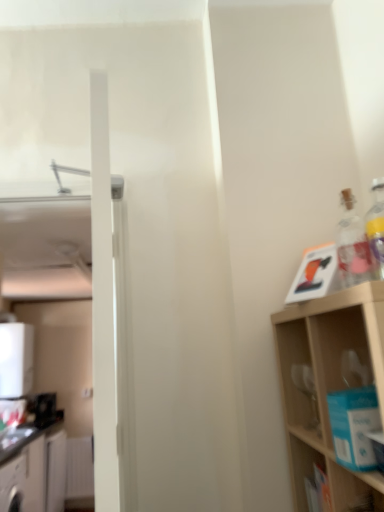
The image size is (384, 512). What do you see at coordinates (352, 244) in the screenshot? I see `transparent glass bottle at upper right` at bounding box center [352, 244].

I want to click on white glossy cabinet at lower left, which is counted as the second cabinetry, starting from the back, so click(13, 485).

Find the location of a particular element. transparent glass bottle at upper right is located at coordinates (352, 244).

Is white glossy cabinet at lower left, the second cabinetry when ordered from front to back, in contact with black plastic toaster at left, arranged as the first appliance when ordered from the bottom?

white glossy cabinet at lower left, the second cabinetry when ordered from front to back, and black plastic toaster at left, arranged as the first appliance when ordered from the bottom, are not in contact.

From the picture: In the image, is white glossy cabinet at lower left, the 1th cabinetry viewed from the back, positioned in front of or behind black plastic toaster at left, the second appliance when ordered from top to bottom?

white glossy cabinet at lower left, the 1th cabinetry viewed from the back, is positioned closer to the viewer than black plastic toaster at left, the second appliance when ordered from top to bottom.

In the scene shown: From the image's perspective, is white glossy cabinet at lower left, the 1th cabinetry viewed from the back, beneath black plastic toaster at left, the second appliance when ordered from top to bottom?

Yes, from the image's perspective, white glossy cabinet at lower left, the 1th cabinetry viewed from the back, is below black plastic toaster at left, the second appliance when ordered from top to bottom.

From a real-world perspective, is white glossy cabinet at lower left, the 1th cabinetry viewed from the back, positioned above or below black plastic toaster at left, the second appliance when ordered from top to bottom?

white glossy cabinet at lower left, the 1th cabinetry viewed from the back, is below black plastic toaster at left, the second appliance when ordered from top to bottom.

Does black plastic toaster at left, the second appliance when ordered from top to bottom, have a lesser height compared to wooden shelf at right?

Yes.

How many degrees apart are the facing directions of black plastic toaster at left, arranged as the first appliance when ordered from the bottom, and wooden shelf at right?

They differ by 90.1 degrees in their facing directions.

Image resolution: width=384 pixels, height=512 pixels. What are the coordinates of `the 1st appliance to the left when counting from the wooden shelf at right` in the screenshot? It's located at (44, 409).

Does black plastic toaster at left, arranged as the first appliance when ordered from the bottom, have a greater width compared to wooden shelf at right?

In fact, black plastic toaster at left, arranged as the first appliance when ordered from the bottom, might be narrower than wooden shelf at right.

Is white glossy cabinet at lower left, the second cabinetry when ordered from front to back, positioned in front of transparent glass bottle at upper right?

No, it is not.

From the picture: From the image's perspective, between white glossy cabinet at lower left, the 1th cabinetry viewed from the back, and transparent glass bottle at upper right, which one is located above?

transparent glass bottle at upper right.

Is white glossy cabinet at lower left, the second cabinetry when ordered from front to back, facing away from transparent glass bottle at upper right?

white glossy cabinet at lower left, the second cabinetry when ordered from front to back, does not have its back to transparent glass bottle at upper right.

Is there a large distance between white glossy cabinet at lower left, the second cabinetry when ordered from front to back, and transparent glass bottle at upper right?

white glossy cabinet at lower left, the second cabinetry when ordered from front to back, is positioned a significant distance from transparent glass bottle at upper right.

Which is correct: white glossy water heater at left, the second appliance when ordered from bottom to top, is inside transparent glass bottle at upper right, or outside of it?

white glossy water heater at left, the second appliance when ordered from bottom to top, is spatially situated outside transparent glass bottle at upper right.

Considering the positions of points (9, 336) and (362, 233), is point (9, 336) farther from camera compared to point (362, 233)?

That is True.

Considering the positions of objects white glossy water heater at left, the second appliance when ordered from bottom to top, and transparent glass bottle at upper right in the image provided, who is more to the right, white glossy water heater at left, the second appliance when ordered from bottom to top, or transparent glass bottle at upper right?

From the viewer's perspective, transparent glass bottle at upper right appears more on the right side.

From the image's perspective, which object appears higher, white glossy water heater at left, the second appliance when ordered from bottom to top, or transparent glass bottle at upper right?

transparent glass bottle at upper right, from the image's perspective.

Which of these two, wooden shelf at right or white glossy cabinet at lower left, the 1th cabinetry viewed from the back, is bigger?

With larger size is white glossy cabinet at lower left, the 1th cabinetry viewed from the back.

Is point (355, 484) less distant than point (47, 500)?

Yes, point (355, 484) is in front of point (47, 500).

Which cabinetry is the 2nd one when counting from the left side of the wooden shelf at right? Please provide its 2D coordinates.

[(33, 469)]

From the image's perspective, is white glossy water heater at left, positioned as the first appliance in top-to-bottom order, on top of black plastic toaster at left, the second appliance when ordered from top to bottom?

Correct, white glossy water heater at left, positioned as the first appliance in top-to-bottom order, appears higher than black plastic toaster at left, the second appliance when ordered from top to bottom, in the image.

Considering the sizes of objects white glossy water heater at left, the second appliance when ordered from bottom to top, and black plastic toaster at left, the second appliance when ordered from top to bottom, in the image provided, who is taller, white glossy water heater at left, the second appliance when ordered from bottom to top, or black plastic toaster at left, the second appliance when ordered from top to bottom,?

white glossy water heater at left, the second appliance when ordered from bottom to top.

In the scene shown: Does white glossy water heater at left, the second appliance when ordered from bottom to top, appear on the left side of black plastic toaster at left, the second appliance when ordered from top to bottom?

Correct, you'll find white glossy water heater at left, the second appliance when ordered from bottom to top, to the left of black plastic toaster at left, the second appliance when ordered from top to bottom.

Is point (17, 466) less distant than point (38, 394)?

Yes, point (17, 466) is closer to viewer.

Is white glossy cabinet at lower left, which is counted as the second cabinetry, starting from the back, positioned far away from black plastic toaster at left, the second appliance when ordered from top to bottom?

Actually, white glossy cabinet at lower left, which is counted as the second cabinetry, starting from the back, and black plastic toaster at left, the second appliance when ordered from top to bottom, are a little close together.

Looking at their sizes, would you say white glossy cabinet at lower left, the first cabinetry viewed from the front, is wider or thinner than black plastic toaster at left, arranged as the first appliance when ordered from the bottom?

In the image, white glossy cabinet at lower left, the first cabinetry viewed from the front, appears to be more narrow than black plastic toaster at left, arranged as the first appliance when ordered from the bottom.

Could you measure the distance between white glossy cabinet at lower left, the first cabinetry viewed from the front, and black plastic toaster at left, the second appliance when ordered from top to bottom?

A distance of 33.13 inches exists between white glossy cabinet at lower left, the first cabinetry viewed from the front, and black plastic toaster at left, the second appliance when ordered from top to bottom.

From the image's perspective, count 1st appliances upward from the white glossy cabinet at lower left, the 1th cabinetry viewed from the back, and point to it. Please provide its 2D coordinates.

[(44, 409)]

This screenshot has height=512, width=384. I want to click on appliance that is the 2nd object located behind the wooden shelf at right, so click(44, 409).

Which object lies further to the anchor point black plastic toaster at left, arranged as the first appliance when ordered from the bottom, white glossy cabinet at lower left, the second cabinetry when ordered from front to back, or white glossy cabinet at lower left, which is counted as the second cabinetry, starting from the back?

Based on the image, white glossy cabinet at lower left, which is counted as the second cabinetry, starting from the back, appears to be further to black plastic toaster at left, arranged as the first appliance when ordered from the bottom.

Considering their positions, is wooden shelf at right positioned further to white glossy cabinet at lower left, the 1th cabinetry viewed from the back, than black plastic toaster at left, the second appliance when ordered from top to bottom?

Based on the image, wooden shelf at right appears to be further to white glossy cabinet at lower left, the 1th cabinetry viewed from the back.

Looking at the image, which one is located closer to white glossy cabinet at lower left, which is counted as the second cabinetry, starting from the back, white glossy cabinet at lower left, the 1th cabinetry viewed from the back, or black plastic toaster at left, the second appliance when ordered from top to bottom?

The object closer to white glossy cabinet at lower left, which is counted as the second cabinetry, starting from the back, is white glossy cabinet at lower left, the 1th cabinetry viewed from the back.

From the image, which object appears to be nearer to white glossy water heater at left, the second appliance when ordered from bottom to top, wooden shelf at right or white glossy cabinet at lower left, the 1th cabinetry viewed from the back?

Among the two, white glossy cabinet at lower left, the 1th cabinetry viewed from the back, is located nearer to white glossy water heater at left, the second appliance when ordered from bottom to top.

Looking at the image, which one is located further to white glossy cabinet at lower left, the first cabinetry viewed from the front, black plastic toaster at left, arranged as the first appliance when ordered from the bottom, or white glossy water heater at left, positioned as the first appliance in top-to-bottom order?

Based on the image, white glossy water heater at left, positioned as the first appliance in top-to-bottom order, appears to be further to white glossy cabinet at lower left, the first cabinetry viewed from the front.

Based on their spatial positions, is black plastic toaster at left, the second appliance when ordered from top to bottom, or wooden shelf at right further from transparent glass bottle at upper right?

black plastic toaster at left, the second appliance when ordered from top to bottom.

When comparing their distances from white glossy water heater at left, the second appliance when ordered from bottom to top, does white glossy cabinet at lower left, the first cabinetry viewed from the front, or wooden shelf at right seem closer?

white glossy cabinet at lower left, the first cabinetry viewed from the front, is positioned closer to the anchor white glossy water heater at left, the second appliance when ordered from bottom to top.

From the image, which object appears to be nearer to white glossy cabinet at lower left, the first cabinetry viewed from the front, white glossy cabinet at lower left, the 1th cabinetry viewed from the back, or white glossy water heater at left, the second appliance when ordered from bottom to top?

The object closer to white glossy cabinet at lower left, the first cabinetry viewed from the front, is white glossy cabinet at lower left, the 1th cabinetry viewed from the back.

Where is `appliance located between white glossy cabinet at lower left, the first cabinetry viewed from the front, and black plastic toaster at left, arranged as the first appliance when ordered from the bottom, in the depth direction`? Image resolution: width=384 pixels, height=512 pixels. appliance located between white glossy cabinet at lower left, the first cabinetry viewed from the front, and black plastic toaster at left, arranged as the first appliance when ordered from the bottom, in the depth direction is located at coordinates (16, 359).

The image size is (384, 512). What are the coordinates of `bottle between wooden shelf at right and white glossy cabinet at lower left, the second cabinetry when ordered from front to back, along the z-axis` in the screenshot? It's located at (352, 244).

At what (x,y) coordinates should I click in order to perform the action: click on cabinetry between transparent glass bottle at upper right and white glossy cabinet at lower left, the second cabinetry when ordered from front to back, in the front-back direction. Please return your answer as a coordinate pair (x, y). This screenshot has height=512, width=384. Looking at the image, I should click on coord(13,485).

Where is `bottle located between wooden shelf at right and black plastic toaster at left, the second appliance when ordered from top to bottom, in the depth direction`? The image size is (384, 512). bottle located between wooden shelf at right and black plastic toaster at left, the second appliance when ordered from top to bottom, in the depth direction is located at coordinates (352, 244).